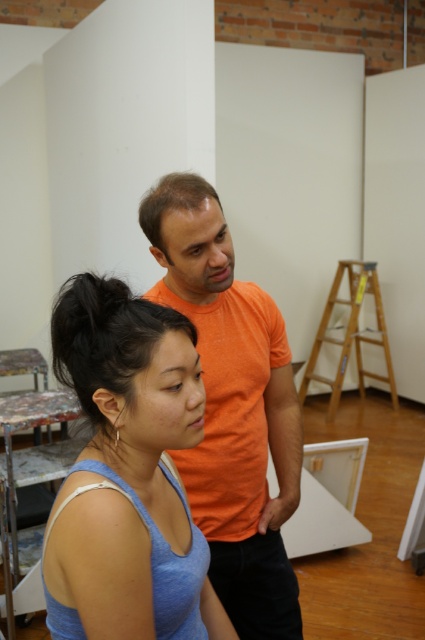
Between point (91, 376) and point (373, 260), which one is positioned behind?

Point (373, 260)

Is blue cotton tank top at lower left behind wooden ladder at right?

No, it is not.

What do you see at coordinates (127, 474) in the screenshot? This screenshot has width=425, height=640. I see `blue cotton tank top at lower left` at bounding box center [127, 474].

In order to click on blue cotton tank top at lower left in this screenshot , I will do `click(127, 474)`.

Does blue cotton tank top at lower left have a larger size compared to brown matte hair at upper center?

Indeed, blue cotton tank top at lower left has a larger size compared to brown matte hair at upper center.

Can you confirm if blue cotton tank top at lower left is taller than brown matte hair at upper center?

Correct, blue cotton tank top at lower left is much taller as brown matte hair at upper center.

Looking at this image, who is more distant from viewer, (102, 406) or (192, 208)?

The point (192, 208) is behind.

Where is `blue cotton tank top at lower left`? The image size is (425, 640). blue cotton tank top at lower left is located at coordinates tap(127, 474).

Is point (136, 618) closer to viewer compared to point (224, 337)?

Yes, it is in front of point (224, 337).

Is blue cotton tank top at lower left to the right of orange cotton shirt at upper center from the viewer's perspective?

In fact, blue cotton tank top at lower left is to the left of orange cotton shirt at upper center.

Is point (125, 548) farther from camera compared to point (241, 602)?

That is False.

This screenshot has height=640, width=425. What are the coordinates of `blue cotton tank top at lower left` in the screenshot? It's located at (127, 474).